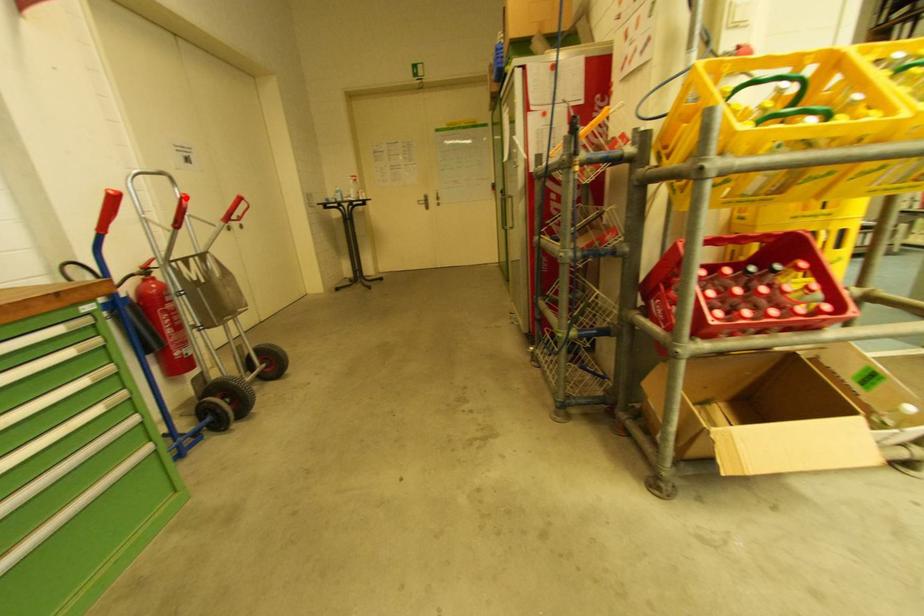
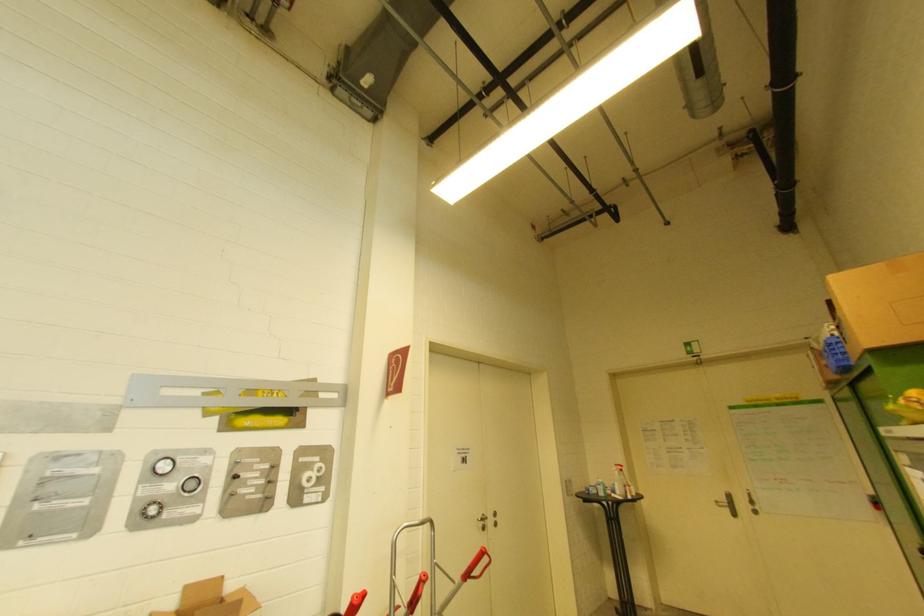
The point at the highlighted location is marked in the first image. Where is the corresponding point in the second image?

(426, 578)